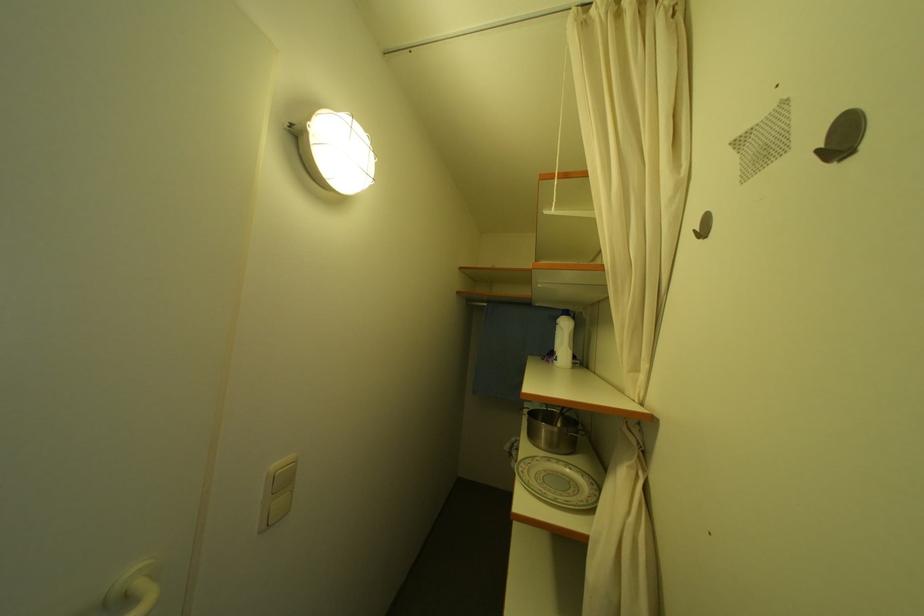
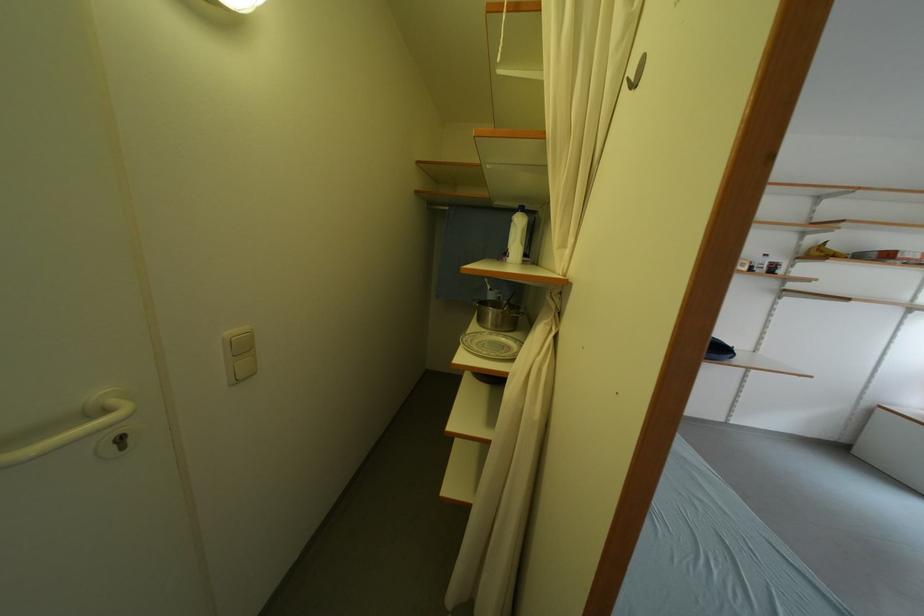
Find the pixel in the second image that matches point (553, 432) in the first image.

(500, 317)